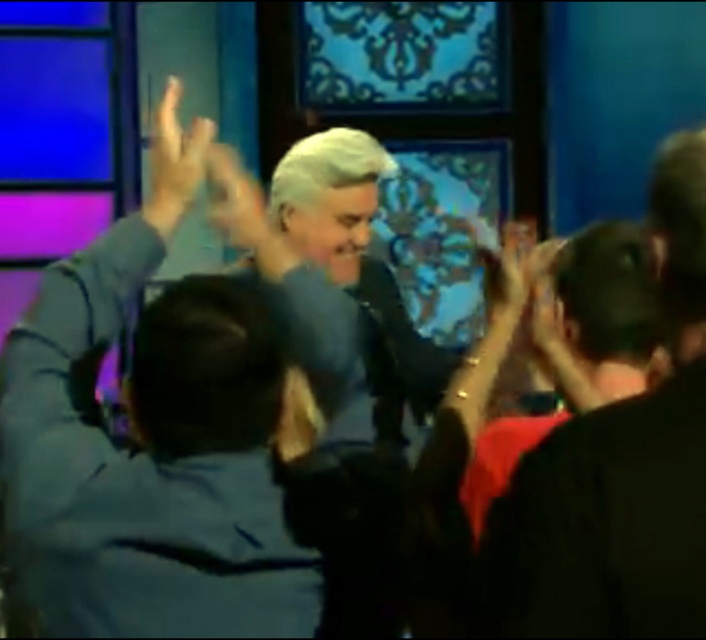
Does dark suit at center lie in front of matte black hand at upper left?

Answer: No, it is not.

Who is more distant from viewer, [282,198] or [155,220]?

The point [282,198] is more distant.

Where is `dark suit at center`? The height and width of the screenshot is (640, 706). dark suit at center is located at coordinates (357, 257).

Can you confirm if smooth black shirt at right is shorter than dark brown hair at upper right?

No.

Which is behind, point (652, 182) or point (671, 195)?

The point (652, 182) is more distant.

This screenshot has width=706, height=640. Identify the location of smooth black shirt at right. (618, 472).

Between smooth black shirt at right and white matte wig at center, which one is positioned higher?

white matte wig at center

Does point (616, 497) lie behind point (381, 164)?

No, (616, 497) is closer to viewer.

You are a GUI agent. You are given a task and a screenshot of the screen. Output one action in this format:
    pyautogui.click(x=<x>, y=<y>)
    Task: Click on the smooth black shirt at right
    
    Given the screenshot: What is the action you would take?
    pyautogui.click(x=618, y=472)